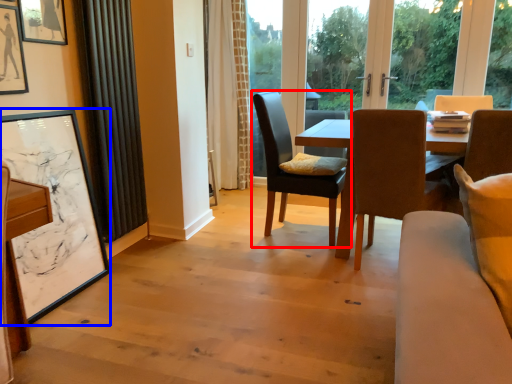
Question: Which point is further to the camera, chair (highlighted by a red box) or picture frame (highlighted by a blue box)?

Choices:
 (A) chair
 (B) picture frame

Answer: (A)